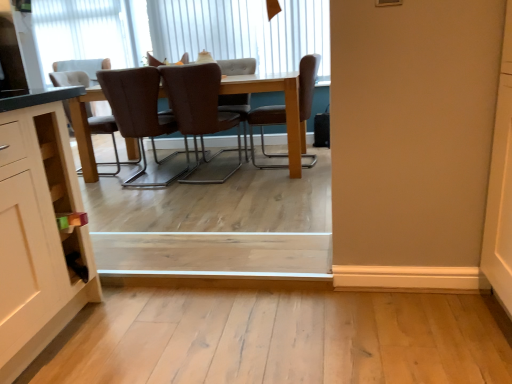
Question: Is brown leather chair at center, the 5th chair when ordered from right to left, wider or thinner than brown leather chair at upper center, which is counted as the 4th chair, starting from the right?

Choices:
 (A) thin
 (B) wide

Answer: (B)

Question: Does point (142, 89) appear closer or farther from the camera than point (156, 61)?

Choices:
 (A) closer
 (B) farther

Answer: (A)

Question: Considering the real-world distances, which object is farthest from the brown leather chair at upper center, which is counted as the 4th chair, starting from the right?

Choices:
 (A) brown leather chair at center, the 1th chair viewed from the right
 (B) brown fabric chair at center, the second chair positioned from the left
 (C) light wood plank at center
 (D) white vertical blinds at upper center, the first window from the bottom
 (E) brown leather chair at center, which ranks as the 3th chair in right-to-left order

Answer: (C)

Question: Considering the real-world distances, which object is farthest from the brown leather chair at center, which ranks as the 3th chair in right-to-left order?

Choices:
 (A) brown fabric chair at center, positioned as the sixth chair in right-to-left order
 (B) brown leather chair at center, the 1th chair viewed from the right
 (C) brown leather chair at center, placed as the 6th chair when sorted from left to right
 (D) white vertical blinds at upper center, the 2th window from the back
 (E) brown leather chair at upper center, which is counted as the fourth chair, starting from the left

Answer: (D)